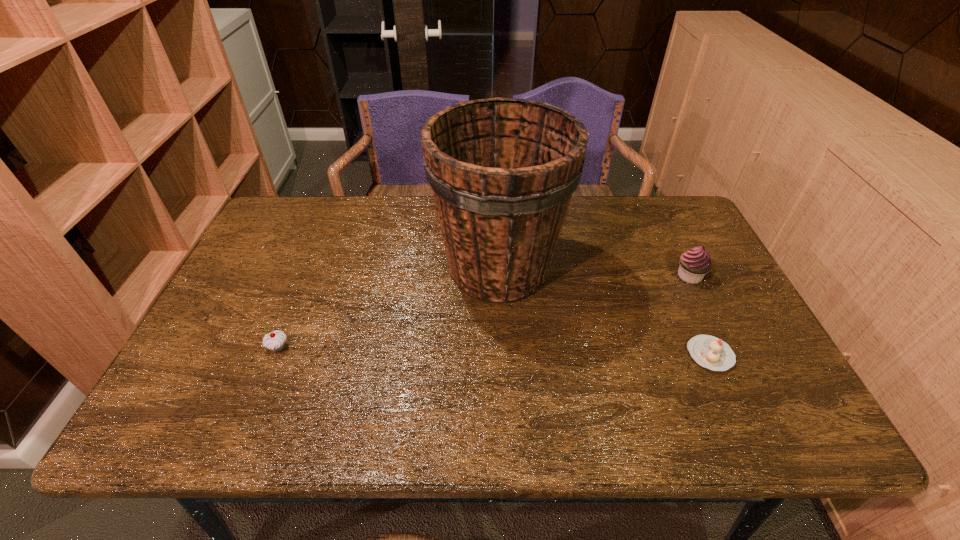
I want to click on free region located 0.050m on the right of the shortest cupcake, so click(754, 355).

In order to click on object at the far edge in this screenshot , I will do `click(502, 171)`.

Locate an element on the screen. The width and height of the screenshot is (960, 540). free location at the far edge of the desktop is located at coordinates (425, 224).

At what (x,y) coordinates should I click in order to perform the action: click on free space at the near edge. Please return your answer as a coordinate pair (x, y). Image resolution: width=960 pixels, height=540 pixels. Looking at the image, I should click on (243, 432).

The image size is (960, 540). Identify the location of vacant space at the left edge. (258, 304).

You are a GUI agent. You are given a task and a screenshot of the screen. Output one action in this format:
    pyautogui.click(x=<x>, y=<y>)
    Task: Click on the vacant space at the right edge of the desktop
    The image size is (960, 540).
    Given the screenshot: What is the action you would take?
    pyautogui.click(x=687, y=288)

Locate an element on the screen. Image resolution: width=960 pixels, height=540 pixels. vacant space at the far left corner of the desktop is located at coordinates (288, 239).

Identify the location of empty space between the farthest cupcake and the second object from left to right. (594, 272).

This screenshot has width=960, height=540. Find the location of `unoccupied position between the second tallest object and the second object from left to right`. unoccupied position between the second tallest object and the second object from left to right is located at coordinates (594, 272).

Where is `vacant region between the leftmost cupcake and the shortest cupcake`? The height and width of the screenshot is (540, 960). vacant region between the leftmost cupcake and the shortest cupcake is located at coordinates (494, 351).